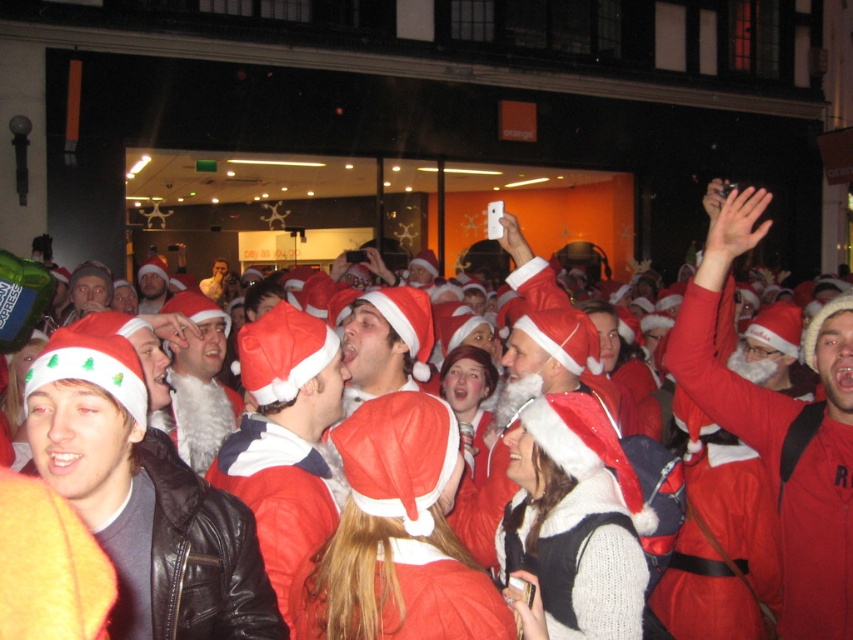
Question: Which object is positioned farthest from the red matte santa hat at upper right?

Choices:
 (A) matte black jacket at center
 (B) white fluffy santa hat at center
 (C) red santa hat at center

Answer: (B)

Question: Which object is positioned closest to the red santa hat at center?

Choices:
 (A) white fluffy santa hat at center
 (B) matte black jacket at center
 (C) red matte santa hat at upper right

Answer: (B)

Question: Which point appears farthest from the camera in this image?

Choices:
 (A) (184, 440)
 (B) (816, 624)
 (C) (144, 422)

Answer: (A)

Question: Is the position of matte black jacket at center more distant than that of red santa hat at center?

Choices:
 (A) no
 (B) yes

Answer: (A)

Question: Does matte black jacket at center appear under red matte santa hat at upper right?

Choices:
 (A) yes
 (B) no

Answer: (A)

Question: Does red matte santa hat at upper right appear under red santa hat at center?

Choices:
 (A) yes
 (B) no

Answer: (B)